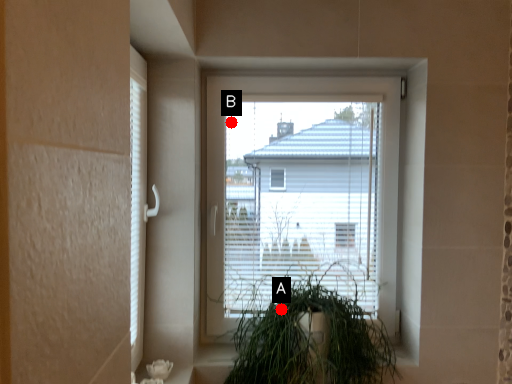
Question: Two points are circled on the image, labeled by A and B beside each circle. Among these points, which one is nearest to the camera?

Choices:
 (A) A is closer
 (B) B is closer

Answer: (A)